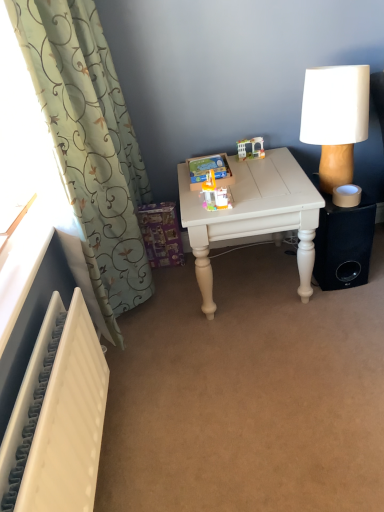
You are a GUI agent. You are given a task and a screenshot of the screen. Output one action in this format:
    pyautogui.click(x=<x>, y=<y>)
    Task: Click on the vacant area that is in front of translucent plastic toy house at upper center, the 1th toy in the top-to-bottom sequence
    The width and height of the screenshot is (384, 512).
    Given the screenshot: What is the action you would take?
    pyautogui.click(x=256, y=168)